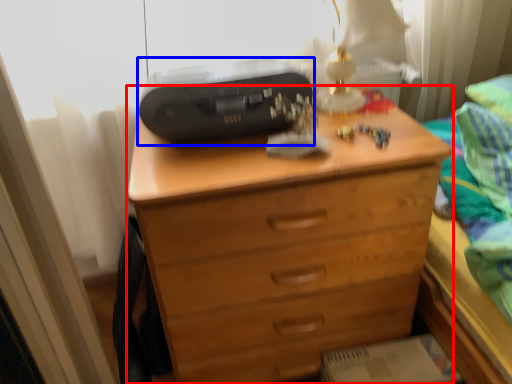
Question: Which object appears farthest to the camera in this image, chest of drawers (highlighted by a red box) or printer (highlighted by a blue box)?

Choices:
 (A) chest of drawers
 (B) printer

Answer: (B)